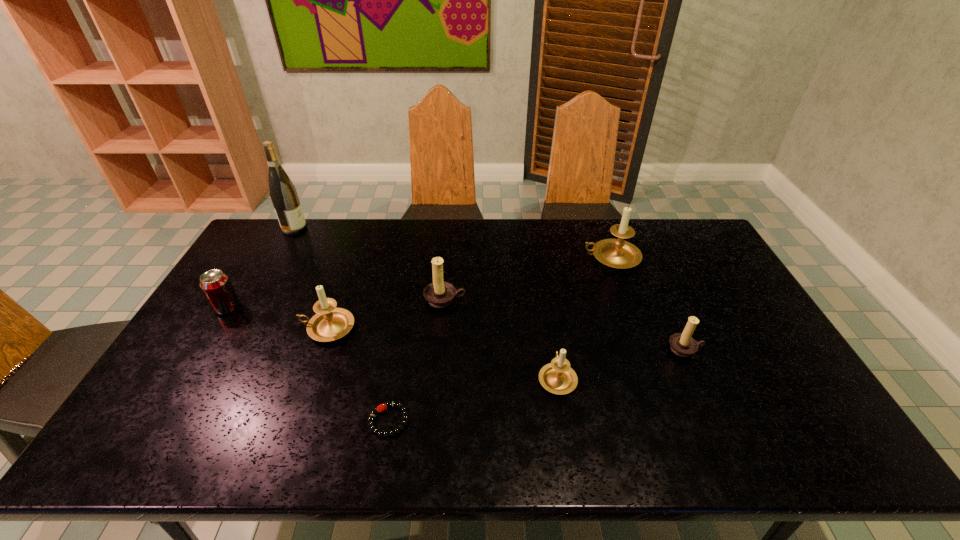
Where is `candle holder that is positioned at the far edge`? candle holder that is positioned at the far edge is located at coordinates (617, 253).

Image resolution: width=960 pixels, height=540 pixels. I want to click on object that is at the near edge, so click(396, 404).

At what (x,y) coordinates should I click in order to perform the action: click on wine bottle located in the left edge section of the desktop. Please return your answer as a coordinate pair (x, y). Looking at the image, I should click on (283, 194).

Where is `soda can at the left edge`? The image size is (960, 540). soda can at the left edge is located at coordinates (216, 286).

The height and width of the screenshot is (540, 960). Find the location of `object located at the far left corner`. object located at the far left corner is located at coordinates (283, 194).

Image resolution: width=960 pixels, height=540 pixels. In the image, there is a desktop. What are the coordinates of `blank space at the far edge` in the screenshot? It's located at (313, 227).

Where is `vacant space at the near edge`? This screenshot has width=960, height=540. vacant space at the near edge is located at coordinates (463, 428).

In the image, there is a desktop. At what (x,y) coordinates should I click in order to perform the action: click on vacant space at the left edge. Please return your answer as a coordinate pair (x, y). This screenshot has width=960, height=540. Looking at the image, I should click on (248, 302).

Where is `vacant region at the near left corner of the desktop`? Image resolution: width=960 pixels, height=540 pixels. vacant region at the near left corner of the desktop is located at coordinates (133, 460).

Where is `free region at the far right corner of the desktop`? The width and height of the screenshot is (960, 540). free region at the far right corner of the desktop is located at coordinates (682, 249).